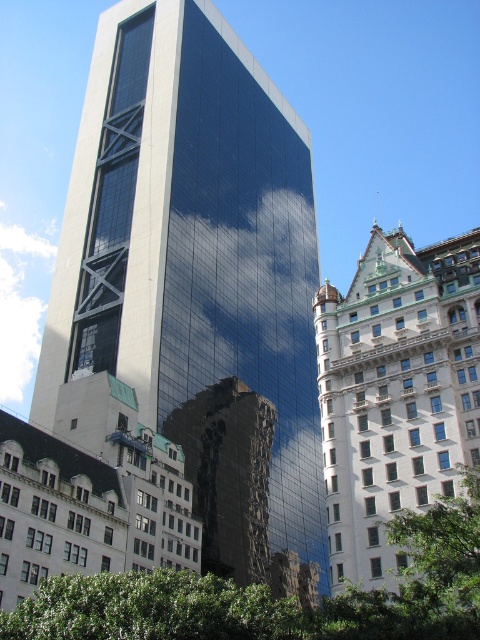
You are a drone operator who needs to fly a drone between the white stone building at right and the reflective glass building at center. The drone has a maximum flight distance of 15 meters. Can the drone safely fly between them without exceeding its range?

The white stone building at right and reflective glass building at center are 16.64 meters apart from each other. Since the drone can only fly up to 15 meters, it cannot safely fly between them without exceeding its range.

Consider the image. You are standing at the point marked as point (396, 392) in the image. Which building are you facing? Please choose between the modern skyscraper on the left and the white stone building at right.

You are facing the white stone building at right because the point (396, 392) corresponds to the white stone building at right.

You are an architect analyzing the urban layout. From your vantage point, which building, the white stone building at right or the reflective glass building at center, appears closer to you?

The white stone building at right is positioned over the reflective glass building at center, so it appears closer to you.